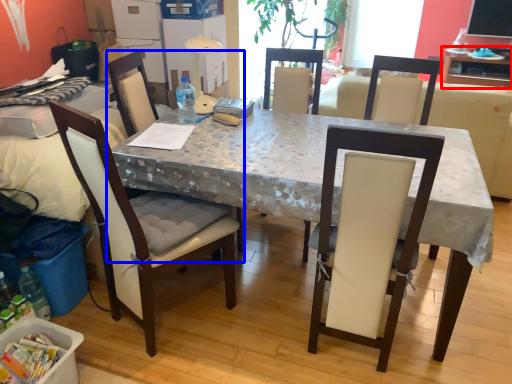
Question: Which object is further to the camera taking this photo, table (highlighted by a red box) or chair (highlighted by a blue box)?

Choices:
 (A) table
 (B) chair

Answer: (A)